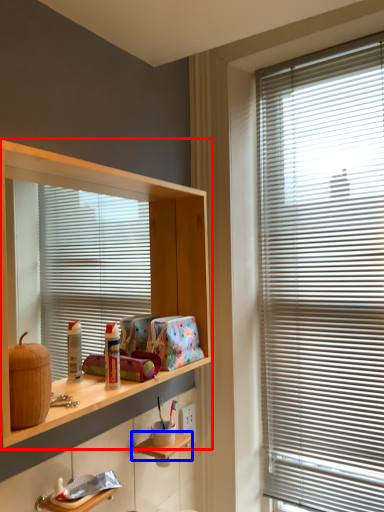
Question: Which object appears farthest to the camera in this image, shelf (highlighted by a red box) or shelf (highlighted by a blue box)?

Choices:
 (A) shelf
 (B) shelf

Answer: (B)